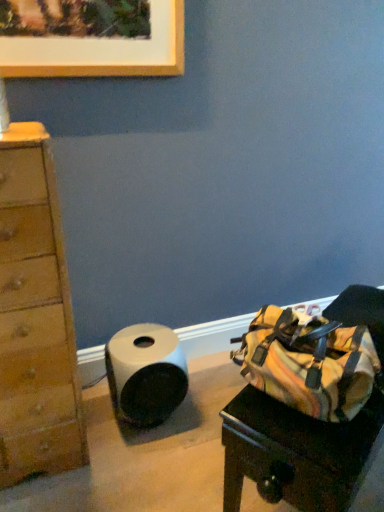
Question: In terms of width, does white matte paper towel at lower left look wider or thinner when compared to striped canvas duffel bag at right?

Choices:
 (A) thin
 (B) wide

Answer: (A)

Question: Visually, is white matte paper towel at lower left positioned to the left or to the right of striped canvas duffel bag at right?

Choices:
 (A) right
 (B) left

Answer: (B)

Question: Does point (140, 395) appear closer or farther from the camera than point (231, 419)?

Choices:
 (A) farther
 (B) closer

Answer: (A)

Question: Is striped canvas duffel bag at right in front of or behind white matte paper towel at lower left in the image?

Choices:
 (A) behind
 (B) front

Answer: (B)

Question: In terms of height, does striped canvas duffel bag at right look taller or shorter compared to white matte paper towel at lower left?

Choices:
 (A) tall
 (B) short

Answer: (A)

Question: Which is correct: striped canvas duffel bag at right is inside white matte paper towel at lower left, or outside of it?

Choices:
 (A) outside
 (B) inside

Answer: (A)

Question: In the image, is striped canvas duffel bag at right on the left side or the right side of white matte paper towel at lower left?

Choices:
 (A) left
 (B) right

Answer: (B)